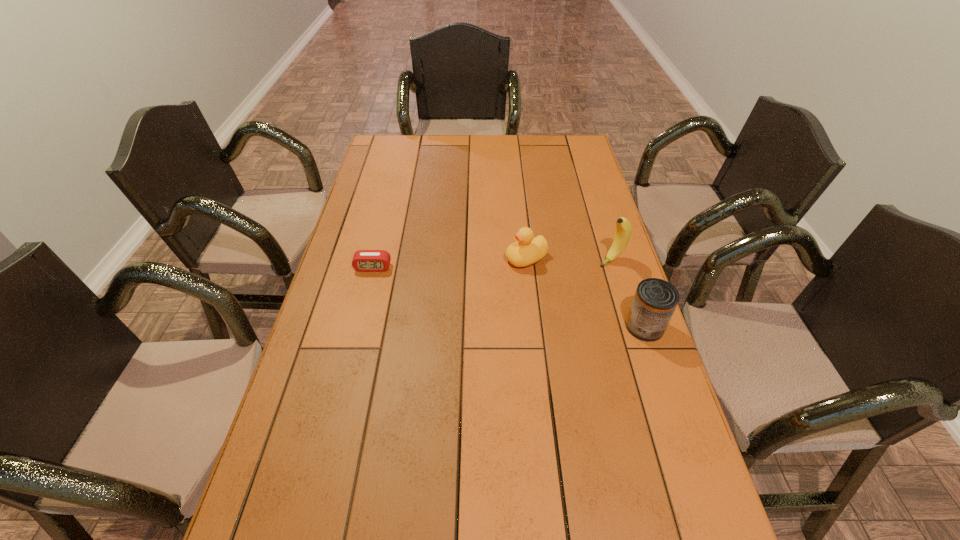
Where is `the shortest object`? the shortest object is located at coordinates (363, 260).

Where is `the leftmost object`? The width and height of the screenshot is (960, 540). the leftmost object is located at coordinates (363, 260).

Find the location of `the nearest object`. the nearest object is located at coordinates (655, 300).

At what (x,y) coordinates should I click in order to perform the action: click on banana. Please return your answer as a coordinate pair (x, y). This screenshot has width=960, height=540. Looking at the image, I should click on (623, 231).

This screenshot has height=540, width=960. In order to click on the third object from right to left in this screenshot , I will do `click(526, 250)`.

Where is `vacant space located on the front-facing side of the alarm clock`? vacant space located on the front-facing side of the alarm clock is located at coordinates (348, 367).

The width and height of the screenshot is (960, 540). In order to click on vacant region located on the left of the nearest object in this screenshot , I will do `click(544, 327)`.

Image resolution: width=960 pixels, height=540 pixels. Identify the location of blank space located from the stem of the banana. (579, 278).

This screenshot has height=540, width=960. I want to click on free space located from the stem of the banana, so click(x=516, y=316).

This screenshot has width=960, height=540. I want to click on vacant point located from the stem of the banana, so click(x=567, y=285).